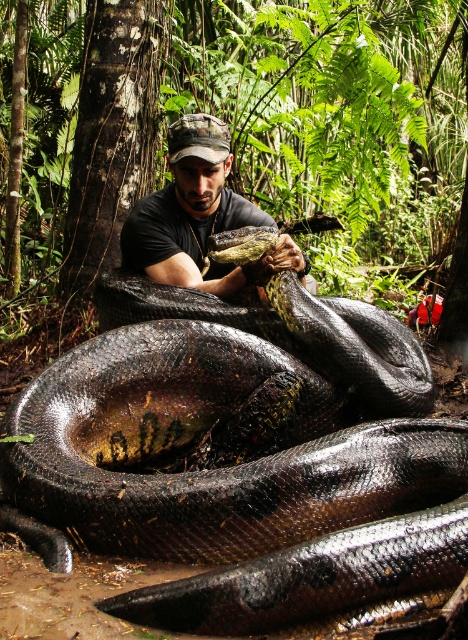
Is shiny black snake at center taller than matte black shirt at center?

Correct, shiny black snake at center is much taller as matte black shirt at center.

Where is `shiny black snake at center`? This screenshot has height=640, width=468. shiny black snake at center is located at coordinates (242, 467).

The image size is (468, 640). In order to click on shiny black snake at center in this screenshot , I will do `click(242, 467)`.